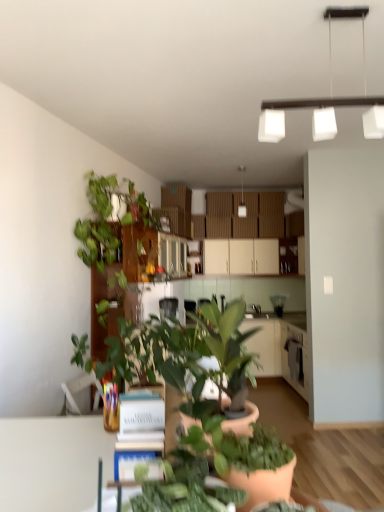
Question: Do you think green leafy plant at left, which ranks as the 1th houseplant in back-to-front order, is within white matte book at center, or outside of it?

Choices:
 (A) inside
 (B) outside

Answer: (B)

Question: Based on their sizes in the image, would you say green leafy plant at left, placed as the third houseplant when sorted from front to back, is bigger or smaller than white matte book at center?

Choices:
 (A) big
 (B) small

Answer: (A)

Question: Considering the real-world distances, which object is farthest from the white matte cabinet at center?

Choices:
 (A) green matte plant at center, the second houseplant viewed from the right
 (B) white matte book at center
 (C) green matte plant at center, which is the 1th houseplant from right to left
 (D) green leafy plant at left, placed as the third houseplant when sorted from front to back

Answer: (C)

Question: Estimate the real-world distances between objects in this image. Which object is farther from the green leafy plant at left, which is the third houseplant from right to left?

Choices:
 (A) white matte cabinet at center
 (B) green matte plant at center, arranged as the second houseplant when viewed from the back
 (C) green matte plant at center, the 3th houseplant when ordered from back to front
 (D) white matte book at center

Answer: (C)